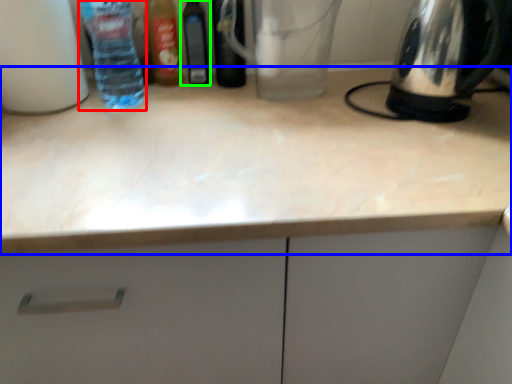
Question: Which is farther away from bottle (highlighted by a red box)? countertop (highlighted by a blue box) or bottle (highlighted by a green box)?

Choices:
 (A) countertop
 (B) bottle

Answer: (A)